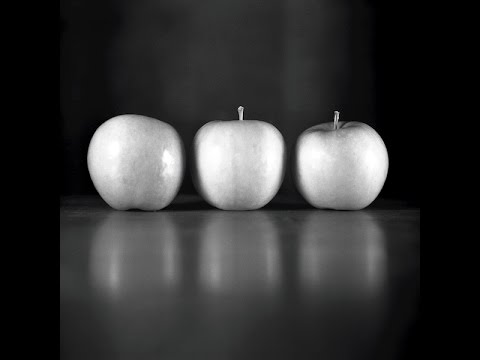
Identify the location of surface apples are on. (262, 287), (80, 191), (187, 194), (284, 191), (389, 200).